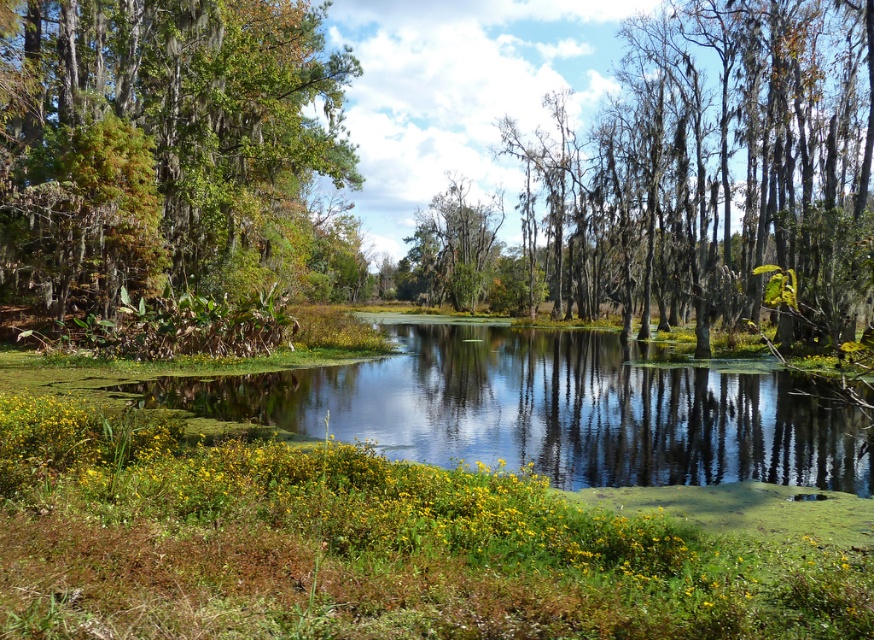
Question: Which point is closer to the camera taking this photo?

Choices:
 (A) (483, 259)
 (B) (63, 260)

Answer: (B)

Question: Is gray mossy trees at center to the left of green mossy tree at upper left from the viewer's perspective?

Choices:
 (A) no
 (B) yes

Answer: (A)

Question: Considering the real-world distances, which object is farthest from the gray mossy trees at center?

Choices:
 (A) green mossy tree at upper left
 (B) green mossy tree at center

Answer: (A)

Question: Where is green mossy tree at upper left located in relation to green mossy tree at center in the image?

Choices:
 (A) right
 (B) left

Answer: (B)

Question: Which point is farther from the camera taking this photo?

Choices:
 (A) (453, 275)
 (B) (243, 225)
 (C) (824, 236)

Answer: (A)

Question: Does green mossy tree at upper left have a smaller size compared to green mossy tree at center?

Choices:
 (A) no
 (B) yes

Answer: (B)